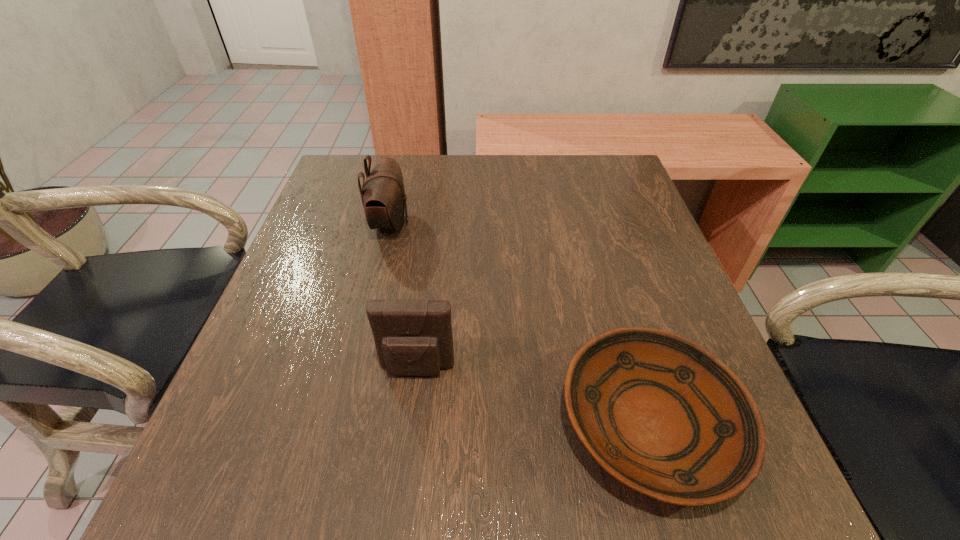
Find the location of a particular element. Image resolution: width=960 pixels, height=540 pixels. the farther pouch is located at coordinates (x=383, y=196).

I want to click on the nearer pouch, so click(x=413, y=337).

Find the location of a particular element. The height and width of the screenshot is (540, 960). the rightmost object is located at coordinates point(662,415).

You are a GUI agent. You are given a task and a screenshot of the screen. Output one action in this format:
    pyautogui.click(x=<x>, y=<y>)
    Task: Click on the plate
    Image resolution: width=960 pixels, height=540 pixels.
    Given the screenshot: What is the action you would take?
    pyautogui.click(x=662, y=415)

At what (x,y) coordinates should I click in order to perform the action: click on free space located with the flap open on the farther pouch. Please return your answer as a coordinate pair (x, y). This screenshot has height=540, width=960. Looking at the image, I should click on (579, 224).

Locate an element on the screen. The height and width of the screenshot is (540, 960). vacant position located with an open flap on the nearer pouch is located at coordinates (401, 496).

Find the location of a particular element. The image size is (960, 540). vacant space located on the left of the plate is located at coordinates (508, 423).

Find the location of a particular element. This screenshot has height=540, width=960. object at the far edge is located at coordinates (383, 196).

What are the coordinates of `object that is at the near edge` in the screenshot? It's located at (662, 415).

This screenshot has width=960, height=540. Find the location of `object present at the left edge`. object present at the left edge is located at coordinates (383, 196).